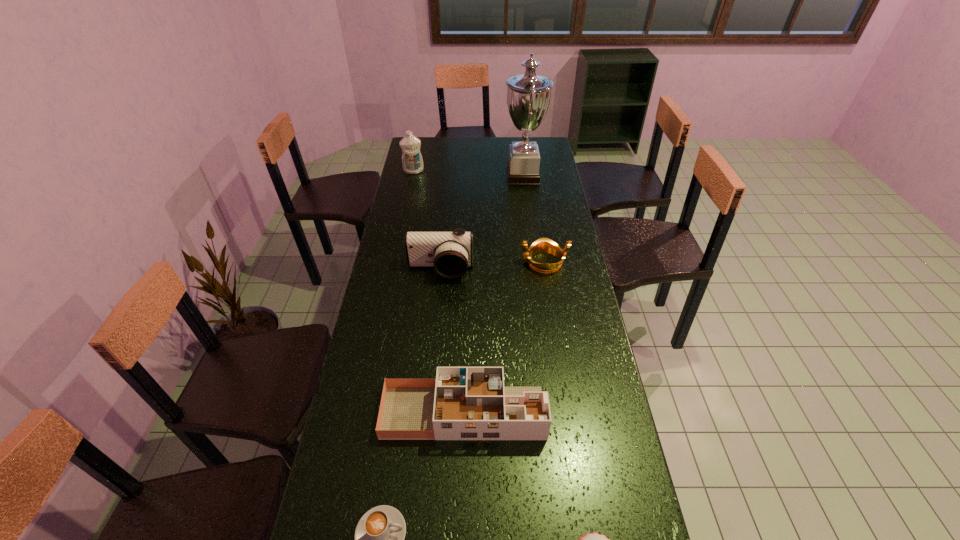
Where is `vacant space at the left edge of the desktop`? This screenshot has height=540, width=960. vacant space at the left edge of the desktop is located at coordinates (364, 430).

This screenshot has width=960, height=540. Identify the location of free location at the right edge. (567, 259).

This screenshot has width=960, height=540. In order to click on free point between the second tallest object and the tallest object in this screenshot , I will do `click(468, 173)`.

Find the location of a particular element. Image resolution: width=960 pixels, height=540 pixels. blank region between the tiara and the detergent is located at coordinates (479, 217).

This screenshot has width=960, height=540. In order to click on free point between the tiara and the trophy cup in this screenshot , I will do `click(533, 219)`.

I want to click on free space between the fifth farthest object and the tallest object, so click(493, 294).

Find the location of a particular element. vacant area between the tallest object and the fifth shortest object is located at coordinates (482, 223).

Where is `object identified as the second closest to the dollhouse`? The height and width of the screenshot is (540, 960). object identified as the second closest to the dollhouse is located at coordinates (594, 539).

Locate which object ranks third in proximity to the cupcake. Please provide its 2D coordinates. Your answer should be formatted as a tuple, i.e. [(x, y)], where the tuple contains the x and y coordinates of a point satisfying the conditions above.

[(450, 253)]

Identify the location of vacant space that satisfies the following two spatial constraints: 1. at the front emblem of the tiara; 2. on the surface of the fifth shortest object. (545, 271).